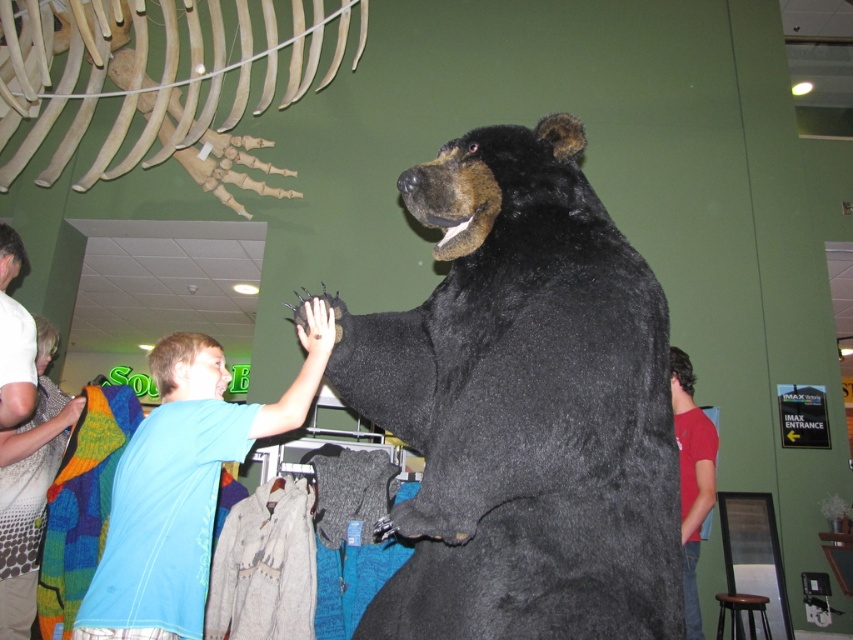
Does blue cotton shirt at lower left have a greater width compared to knitted sweater at left?

Indeed, blue cotton shirt at lower left has a greater width compared to knitted sweater at left.

Is blue cotton shirt at lower left above knitted sweater at left?

Indeed, blue cotton shirt at lower left is positioned over knitted sweater at left.

What do you see at coordinates (183, 484) in the screenshot? The height and width of the screenshot is (640, 853). I see `blue cotton shirt at lower left` at bounding box center [183, 484].

Image resolution: width=853 pixels, height=640 pixels. What are the coordinates of `blue cotton shirt at lower left` in the screenshot? It's located at (183, 484).

Is black plush bear at center smaller than red cotton shirt at right?

Incorrect, black plush bear at center is not smaller in size than red cotton shirt at right.

Who is positioned more to the left, black plush bear at center or red cotton shirt at right?

Positioned to the left is black plush bear at center.

Who is more forward, (521,529) or (695,577)?

Point (521,529) is in front.

Locate an element on the screen. Image resolution: width=853 pixels, height=640 pixels. black plush bear at center is located at coordinates (523, 406).

Is black plush bear at center positioned at the back of knitted sweater at left?

That is False.

From the picture: Who is positioned more to the left, black plush bear at center or knitted sweater at left?

knitted sweater at left is more to the left.

Between point (587, 444) and point (38, 516), which one is positioned behind?

The point (38, 516) is behind.

The height and width of the screenshot is (640, 853). In order to click on black plush bear at center in this screenshot , I will do `click(523, 406)`.